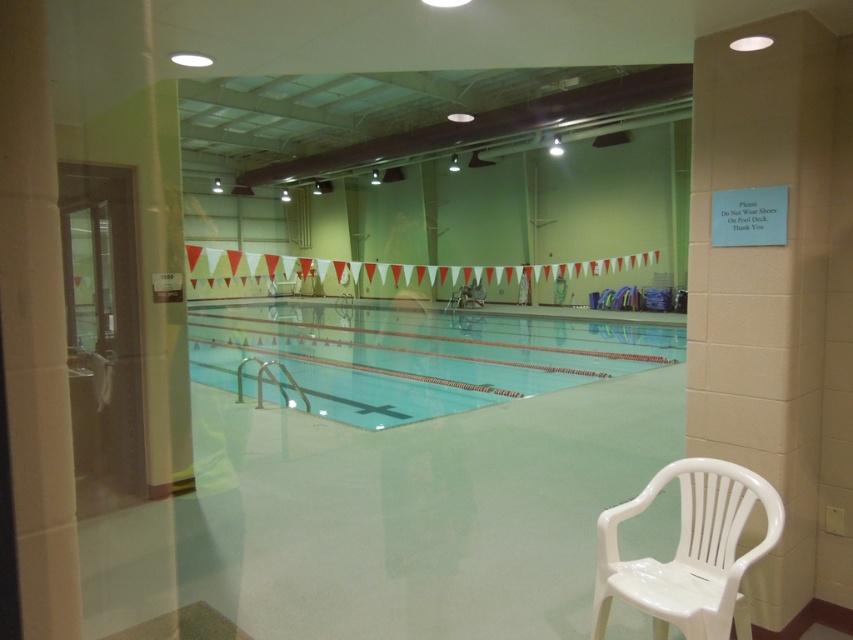
Question: Is clear glass pool at center closer to camera compared to white plastic chair at lower right?

Choices:
 (A) yes
 (B) no

Answer: (B)

Question: Observing the image, what is the correct spatial positioning of clear glass pool at center in reference to white plastic chair at lower right?

Choices:
 (A) left
 (B) right

Answer: (A)

Question: Does clear glass pool at center have a lesser width compared to white plastic chair at lower right?

Choices:
 (A) no
 (B) yes

Answer: (A)

Question: Which point appears farthest from the camera in this image?

Choices:
 (A) (473, 349)
 (B) (720, 614)

Answer: (A)